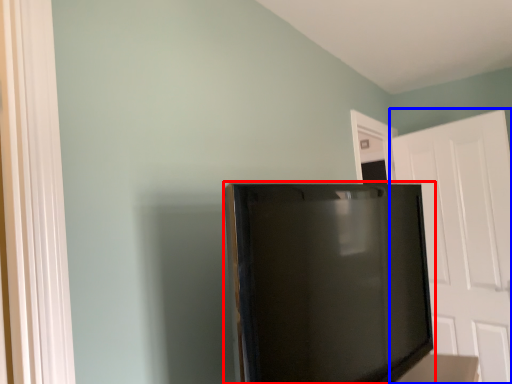
Question: Which of the following is the closest to the observer, refrigerator (highlighted by a red box) or door (highlighted by a blue box)?

Choices:
 (A) refrigerator
 (B) door

Answer: (A)